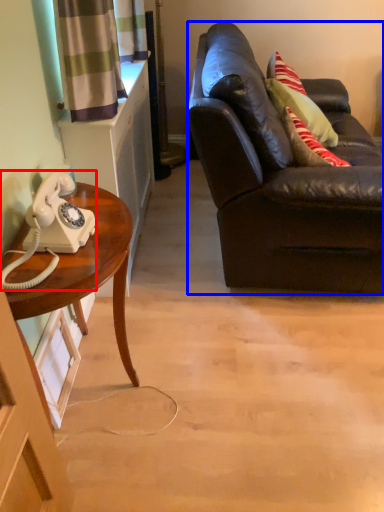
Question: Which point is further to the camera, corded phone (highlighted by a red box) or studio couch (highlighted by a blue box)?

Choices:
 (A) corded phone
 (B) studio couch

Answer: (B)